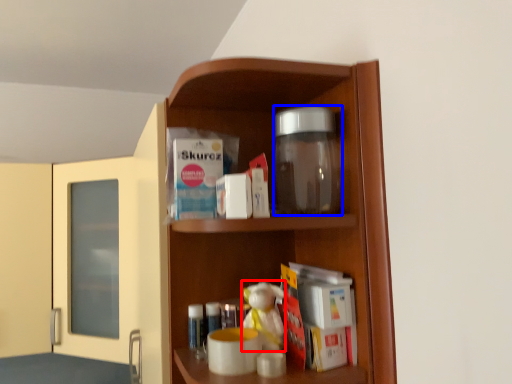
Question: Which point is further to the camera, toy (highlighted by a red box) or glass jar (highlighted by a blue box)?

Choices:
 (A) toy
 (B) glass jar

Answer: (A)